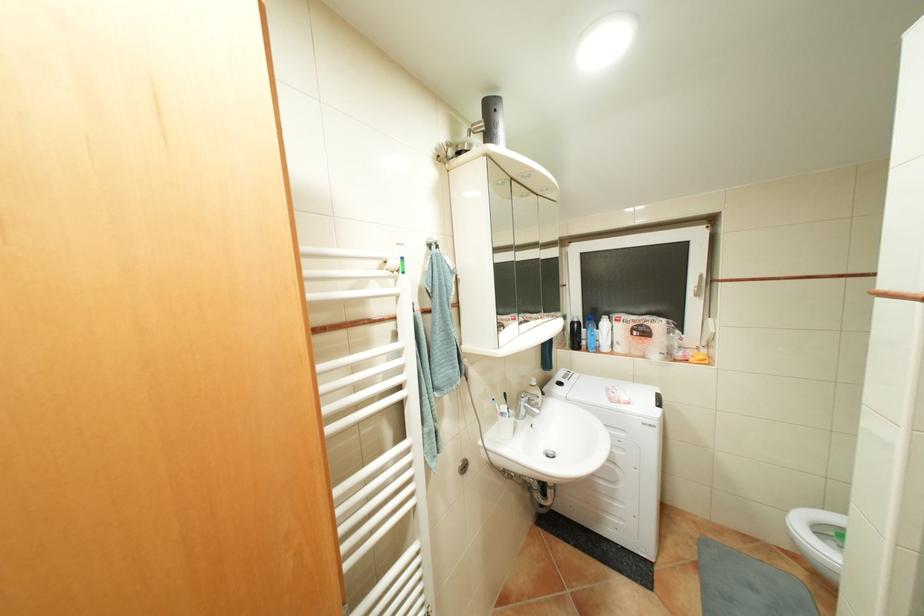
At what (x,y) coordinates should I click in order to perform the action: click on toothbrush. Please return your answer as a coordinate pair (x, y). This screenshot has width=924, height=616. Looking at the image, I should click on (494, 406).